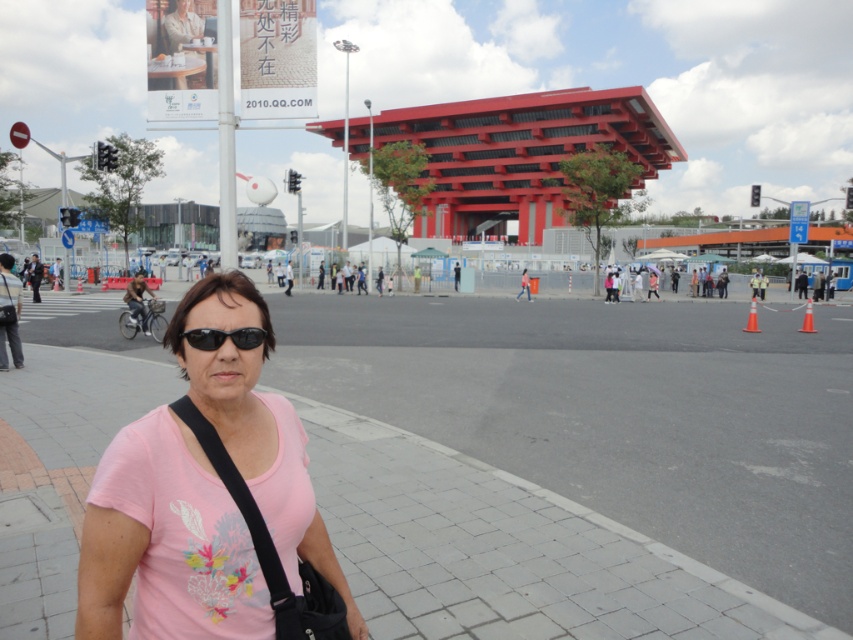
Can you confirm if gray concrete pavement at lower left is shorter than pink fabric shirt at center?

No, gray concrete pavement at lower left is not shorter than pink fabric shirt at center.

Does gray concrete pavement at lower left have a larger size compared to pink fabric shirt at center?

Yes, gray concrete pavement at lower left is bigger than pink fabric shirt at center.

Between point (3, 404) and point (213, 401), which one is positioned behind?

Point (3, 404)

Locate an element on the screen. The height and width of the screenshot is (640, 853). gray concrete pavement at lower left is located at coordinates (576, 465).

Can you confirm if gray concrete pavement at lower left is positioned below black matte sunglasses at center?

Indeed, gray concrete pavement at lower left is positioned under black matte sunglasses at center.

Between gray concrete pavement at lower left and black matte sunglasses at center, which one is positioned lower?

gray concrete pavement at lower left

Who is more distant from viewer, (x=666, y=516) or (x=247, y=337)?

The point (x=666, y=516) is behind.

I want to click on gray concrete pavement at lower left, so click(576, 465).

Does pink fabric shirt at center appear over black matte sunglasses at center?

No.

Is point (164, 596) in front of point (247, 330)?

Yes, point (164, 596) is in front of point (247, 330).

This screenshot has height=640, width=853. Find the location of `pink fabric shirt at center`. pink fabric shirt at center is located at coordinates (166, 541).